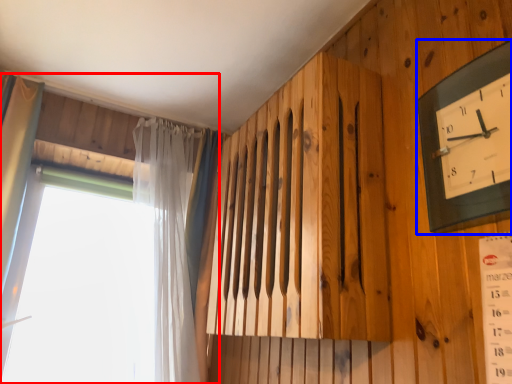
Question: Among these objects, which one is nearest to the camera, window (highlighted by a red box) or wall clock (highlighted by a blue box)?

Choices:
 (A) window
 (B) wall clock

Answer: (B)